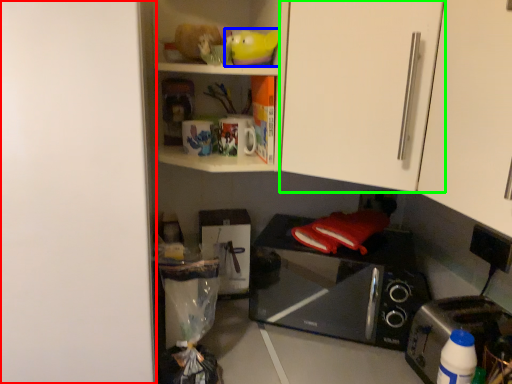
Question: Considering the real-world distances, which object is farthest from door (highlighted by a red box)? toy (highlighted by a blue box) or cabinetry (highlighted by a green box)?

Choices:
 (A) toy
 (B) cabinetry

Answer: (A)